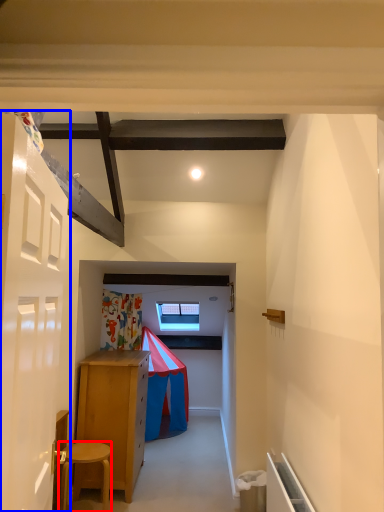
Question: Which object appears farthest to the camera in this image, stool (highlighted by a red box) or door (highlighted by a blue box)?

Choices:
 (A) stool
 (B) door

Answer: (A)